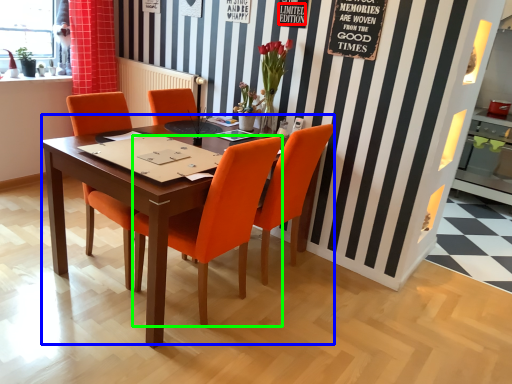
Question: Considering the real-world distances, which object is closest to writing (highlighted by a red box)? kitchen & dining room table (highlighted by a blue box) or chair (highlighted by a green box).

Choices:
 (A) kitchen & dining room table
 (B) chair

Answer: (B)